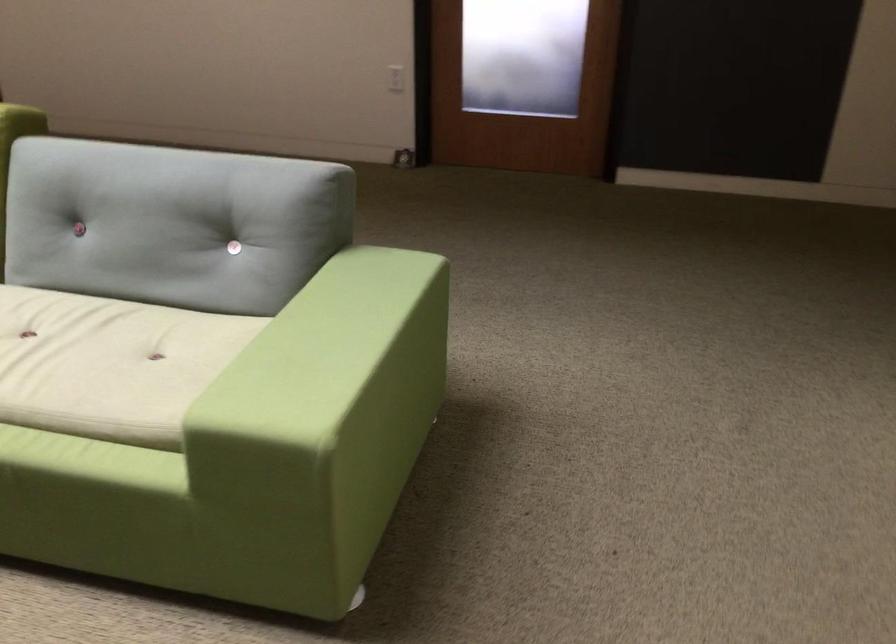
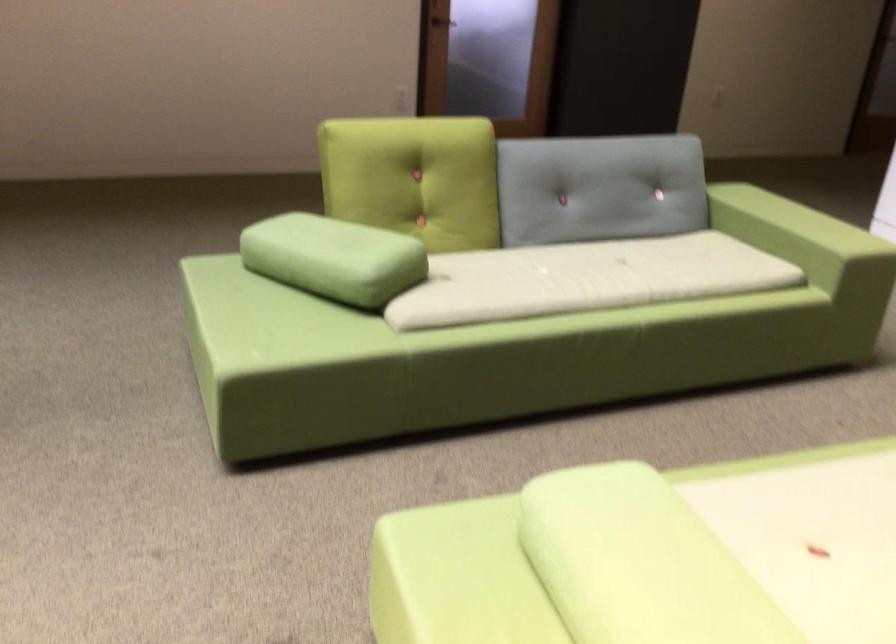
The point at [240,377] is marked in the first image. Where is the corresponding point in the second image?

(794, 241)